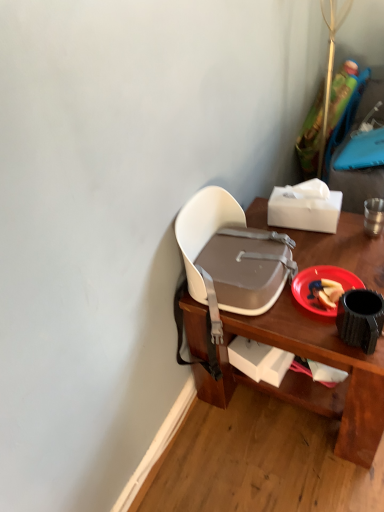
Image resolution: width=384 pixels, height=512 pixels. Find the location of `vacant space to the right of red plastic plate at lower right`. vacant space to the right of red plastic plate at lower right is located at coordinates (367, 265).